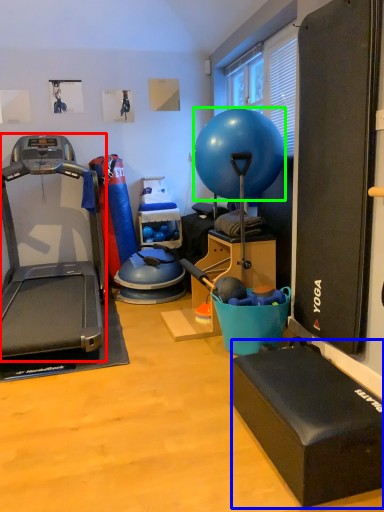
Question: Which object is positioned farthest from treadmill (highlighted by a red box)? Select from box (highlighted by a blue box) and ball (highlighted by a green box).

Choices:
 (A) box
 (B) ball

Answer: (A)